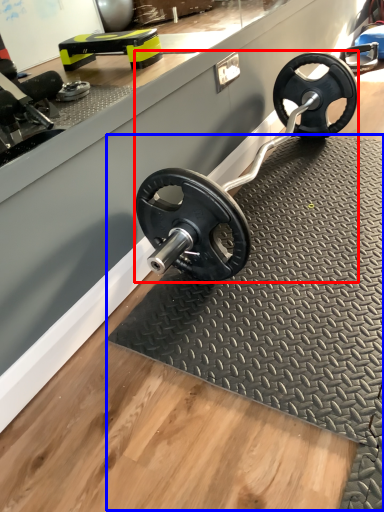
Question: Which of the following is the closest to the observer, sport equipment (highlighted by a red box) or mat (highlighted by a blue box)?

Choices:
 (A) sport equipment
 (B) mat

Answer: (B)